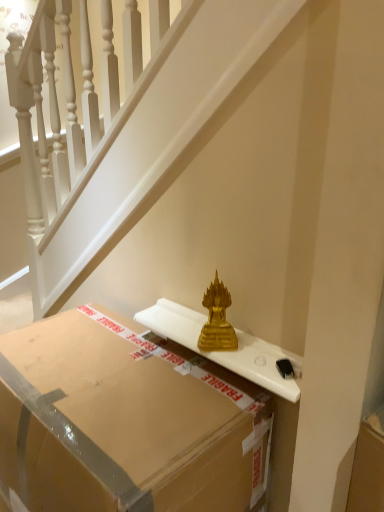
Question: From the image's perspective, is gold metallic statue at center located beneath gold glass sculpture at center?

Choices:
 (A) no
 (B) yes

Answer: (A)

Question: Does gold metallic statue at center appear on the right side of gold glass sculpture at center?

Choices:
 (A) yes
 (B) no

Answer: (B)

Question: Is gold metallic statue at center bigger than gold glass sculpture at center?

Choices:
 (A) no
 (B) yes

Answer: (B)

Question: Is gold metallic statue at center positioned far away from gold glass sculpture at center?

Choices:
 (A) yes
 (B) no

Answer: (B)

Question: Does gold metallic statue at center come behind gold glass sculpture at center?

Choices:
 (A) yes
 (B) no

Answer: (B)

Question: Is gold glass sculpture at center situated inside matte cardboard box at center or outside?

Choices:
 (A) inside
 (B) outside

Answer: (B)

Question: Relative to matte cardboard box at center, is gold glass sculpture at center in front or behind?

Choices:
 (A) behind
 (B) front

Answer: (A)

Question: From a real-world perspective, is gold glass sculpture at center physically located above or below matte cardboard box at center?

Choices:
 (A) below
 (B) above

Answer: (B)

Question: From the image's perspective, is gold glass sculpture at center above or below matte cardboard box at center?

Choices:
 (A) below
 (B) above

Answer: (B)

Question: Looking at their shapes, would you say gold metallic statue at center is wider or thinner than gold glass sculpture at center?

Choices:
 (A) thin
 (B) wide

Answer: (A)

Question: Which is correct: gold metallic statue at center is inside gold glass sculpture at center, or outside of it?

Choices:
 (A) inside
 (B) outside

Answer: (B)

Question: Is point (61, 217) closer or farther from the camera than point (210, 322)?

Choices:
 (A) farther
 (B) closer

Answer: (A)

Question: Is gold metallic statue at center to the left or to the right of gold glass sculpture at center in the image?

Choices:
 (A) right
 (B) left

Answer: (B)

Question: Is matte cardboard box at center taller or shorter than gold metallic statue at center?

Choices:
 (A) tall
 (B) short

Answer: (B)

Question: Is matte cardboard box at center wider or thinner than gold metallic statue at center?

Choices:
 (A) thin
 (B) wide

Answer: (B)